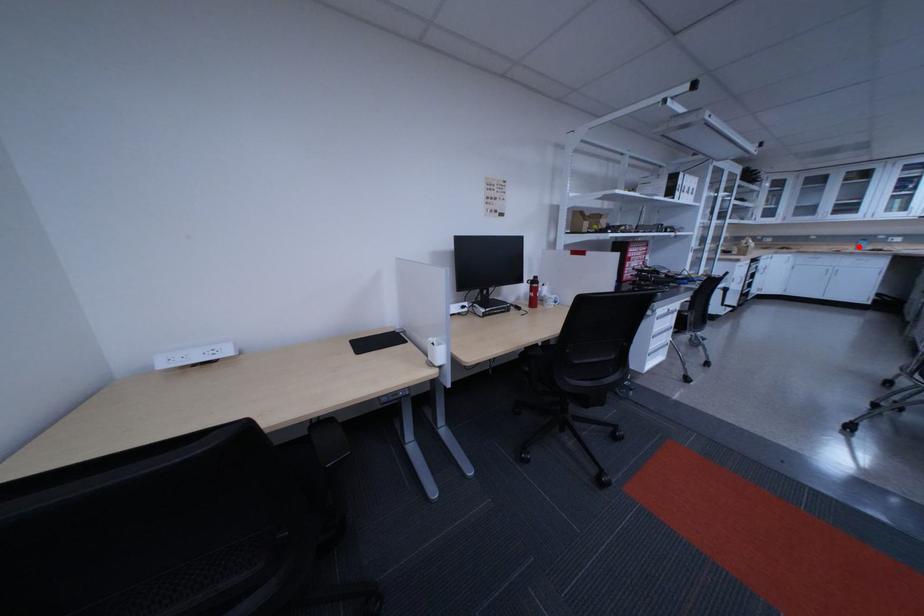
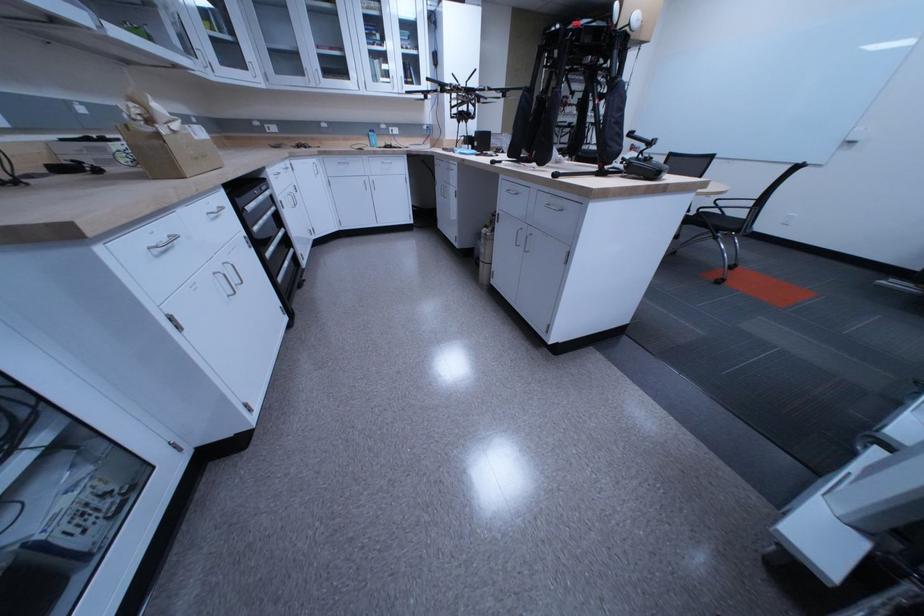
Find the pixel in the second image that matches the highlighted location in the first image.

(373, 140)